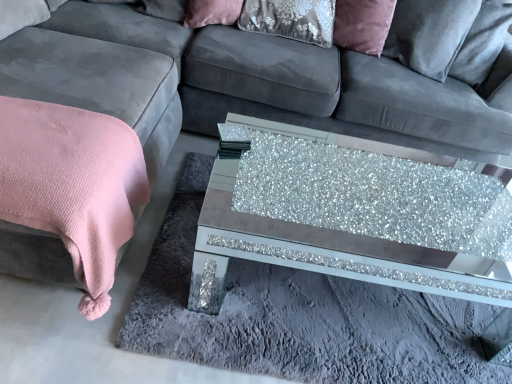
Question: Should I look upward or downward to see velvet/matte pillow at upper center?

Choices:
 (A) up
 (B) down

Answer: (A)

Question: Does velvet/matte pillow at upper center have a lesser width compared to pink textured blanket at left?

Choices:
 (A) no
 (B) yes

Answer: (B)

Question: From the image's perspective, is velvet/matte pillow at upper center on top of pink textured blanket at left?

Choices:
 (A) yes
 (B) no

Answer: (A)

Question: Can you confirm if velvet/matte pillow at upper center is taller than pink textured blanket at left?

Choices:
 (A) no
 (B) yes

Answer: (A)

Question: From a real-world perspective, is velvet/matte pillow at upper center physically below pink textured blanket at left?

Choices:
 (A) no
 (B) yes

Answer: (A)

Question: Is velvet/matte pillow at upper center facing towards pink textured blanket at left?

Choices:
 (A) no
 (B) yes

Answer: (A)

Question: Can you confirm if velvet/matte pillow at upper center is bigger than pink textured blanket at left?

Choices:
 (A) no
 (B) yes

Answer: (A)

Question: Is pink textured blanket at left not close to glittery glass coffee table at center?

Choices:
 (A) no
 (B) yes

Answer: (B)

Question: From the image's perspective, does pink textured blanket at left appear higher than glittery glass coffee table at center?

Choices:
 (A) no
 (B) yes

Answer: (B)

Question: Is pink textured blanket at left at the right side of glittery glass coffee table at center?

Choices:
 (A) yes
 (B) no

Answer: (B)

Question: From the image's perspective, is pink textured blanket at left under glittery glass coffee table at center?

Choices:
 (A) no
 (B) yes

Answer: (A)

Question: From a real-world perspective, is pink textured blanket at left physically below glittery glass coffee table at center?

Choices:
 (A) no
 (B) yes

Answer: (A)

Question: Is pink textured blanket at left further to camera compared to glittery glass coffee table at center?

Choices:
 (A) no
 (B) yes

Answer: (A)

Question: Is pink textured blanket at left not within velvet/matte pillow at upper center?

Choices:
 (A) no
 (B) yes

Answer: (B)